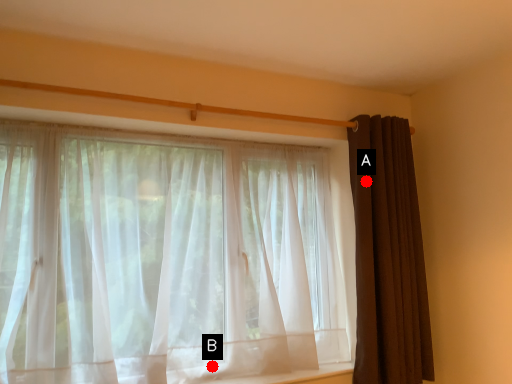
Question: Two points are circled on the image, labeled by A and B beside each circle. Which point is closer to the camera?

Choices:
 (A) A is closer
 (B) B is closer

Answer: (B)